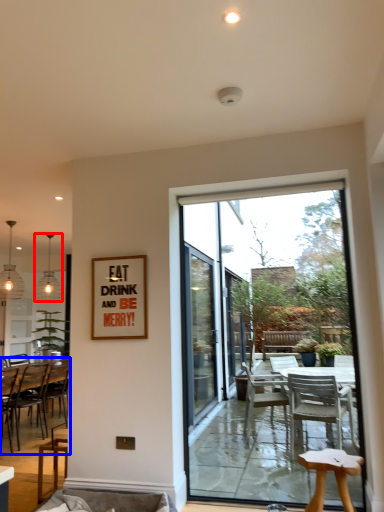
Question: Among these objects, which one is nearest to the camera, lamp (highlighted by a red box) or chair (highlighted by a blue box)?

Choices:
 (A) lamp
 (B) chair

Answer: (B)